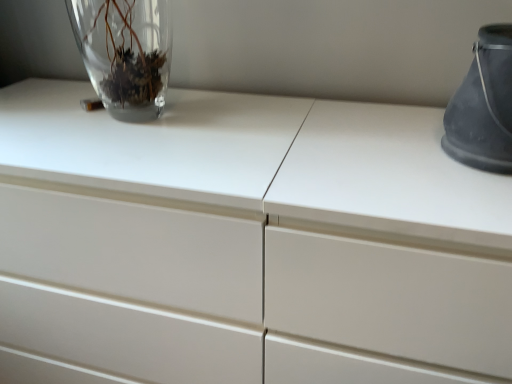
Question: Is matte gray bucket at right, marked as the 2th vase in a left-to-right arrangement, oriented towards transparent glass vase at upper left, marked as the 1th vase in a left-to-right arrangement?

Choices:
 (A) no
 (B) yes

Answer: (A)

Question: From the image's perspective, is matte gray bucket at right, marked as the 2th vase in a left-to-right arrangement, below transparent glass vase at upper left, which is counted as the 2th vase, starting from the right?

Choices:
 (A) yes
 (B) no

Answer: (A)

Question: From the image's perspective, is matte gray bucket at right, marked as the 2th vase in a left-to-right arrangement, over transparent glass vase at upper left, which is counted as the 2th vase, starting from the right?

Choices:
 (A) yes
 (B) no

Answer: (B)

Question: Is matte gray bucket at right, placed as the first vase when sorted from right to left, oriented away from transparent glass vase at upper left, which is counted as the 2th vase, starting from the right?

Choices:
 (A) yes
 (B) no

Answer: (B)

Question: Can you confirm if matte gray bucket at right, marked as the 2th vase in a left-to-right arrangement, is positioned to the right of transparent glass vase at upper left, which is counted as the 2th vase, starting from the right?

Choices:
 (A) no
 (B) yes

Answer: (B)

Question: Does matte gray bucket at right, placed as the first vase when sorted from right to left, have a lesser width compared to transparent glass vase at upper left, marked as the 1th vase in a left-to-right arrangement?

Choices:
 (A) yes
 (B) no

Answer: (B)

Question: Is transparent glass vase at upper left, which is counted as the 2th vase, starting from the right, at the left side of matte gray bucket at right, marked as the 2th vase in a left-to-right arrangement?

Choices:
 (A) no
 (B) yes

Answer: (B)

Question: Does transparent glass vase at upper left, which is counted as the 2th vase, starting from the right, have a greater height compared to matte gray bucket at right, placed as the first vase when sorted from right to left?

Choices:
 (A) yes
 (B) no

Answer: (A)

Question: Is matte gray bucket at right, placed as the first vase when sorted from right to left, at the back of transparent glass vase at upper left, marked as the 1th vase in a left-to-right arrangement?

Choices:
 (A) no
 (B) yes

Answer: (A)

Question: From the image's perspective, does transparent glass vase at upper left, which is counted as the 2th vase, starting from the right, appear higher than matte gray bucket at right, marked as the 2th vase in a left-to-right arrangement?

Choices:
 (A) no
 (B) yes

Answer: (B)

Question: From a real-world perspective, does transparent glass vase at upper left, marked as the 1th vase in a left-to-right arrangement, stand above matte gray bucket at right, placed as the first vase when sorted from right to left?

Choices:
 (A) no
 (B) yes

Answer: (B)

Question: Does transparent glass vase at upper left, marked as the 1th vase in a left-to-right arrangement, have a lesser width compared to matte gray bucket at right, placed as the first vase when sorted from right to left?

Choices:
 (A) yes
 (B) no

Answer: (A)

Question: Is matte gray bucket at right, placed as the first vase when sorted from right to left, bigger or smaller than transparent glass vase at upper left, which is counted as the 2th vase, starting from the right?

Choices:
 (A) small
 (B) big

Answer: (B)